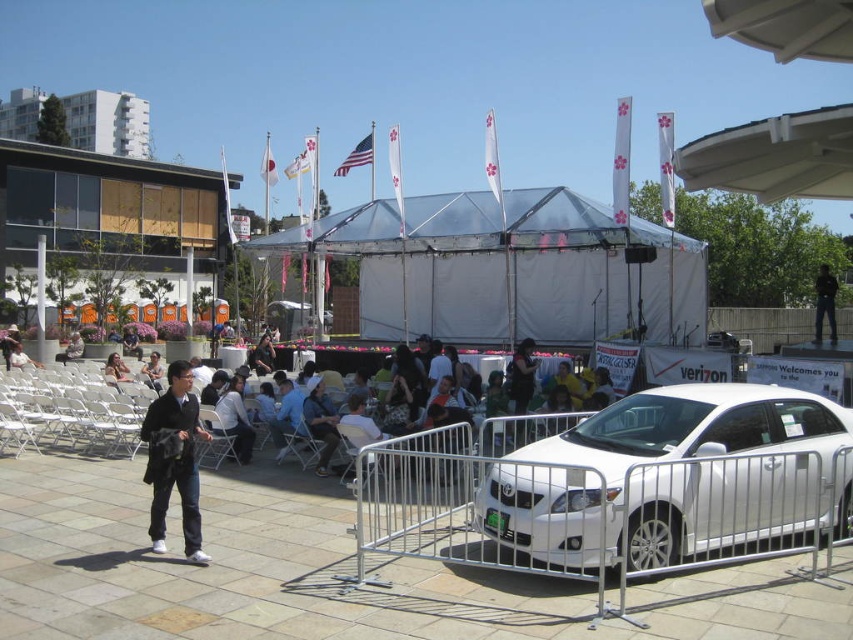
You are a photographer at the event and need to capture a photo of both the denim jacket at center and white cotton shirt at lower left. Considering their heights, which clothing item will appear larger in the photo?

The denim jacket at center will appear larger in the photo because it is much taller than the white cotton shirt at lower left.

You are a photographer at the event and need to capture a photo of both the denim jacket at center and the white cotton shirt at lower left. Which clothing item appears smaller in the photo?

The denim jacket at center appears smaller in the photo compared to the white cotton shirt at lower left because it has a smaller size.